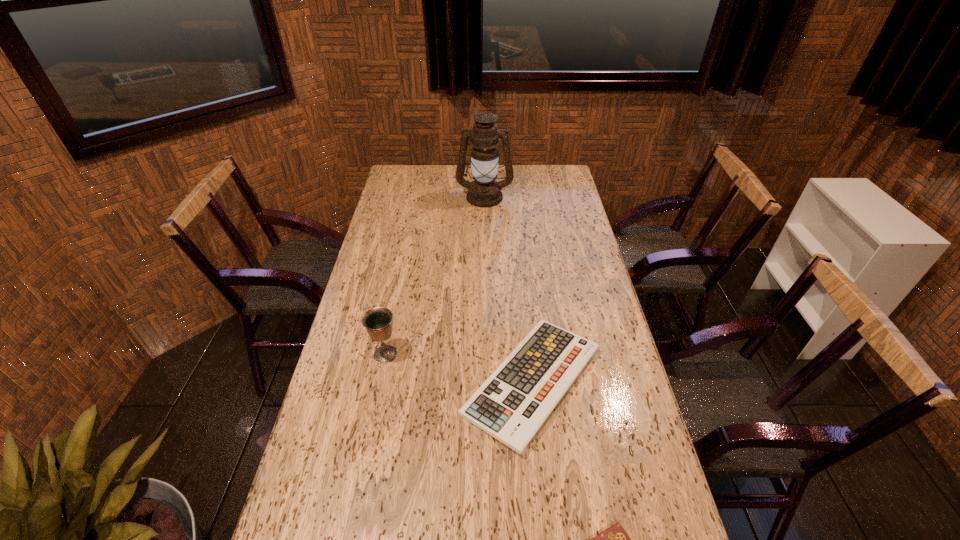
Image resolution: width=960 pixels, height=540 pixels. Identify the location of free space between the tallest object and the computer keyboard. (x=508, y=289).

Locate which object is the closest to the farthest object. Please provide its 2D coordinates. Your answer should be formatted as a tuple, i.e. [(x, y)], where the tuple contains the x and y coordinates of a point satisfying the conditions above.

[(512, 404)]

Where is `object that is the second closest to the farthest object`? The width and height of the screenshot is (960, 540). object that is the second closest to the farthest object is located at coordinates (378, 321).

Find the location of a particular element. The width and height of the screenshot is (960, 540). free space that satisfies the following two spatial constraints: 1. on the back side of the oil lamp; 2. on the right side of the leftmost object is located at coordinates 417,197.